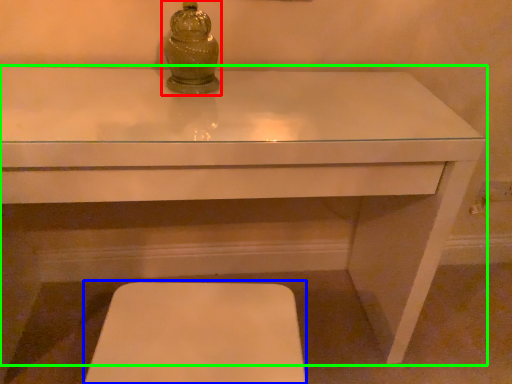
Question: Based on their relative distances, which object is nearer to candle holder (highlighted by a red box)? Choose from step stool (highlighted by a blue box) and table (highlighted by a green box).

Choices:
 (A) step stool
 (B) table

Answer: (B)